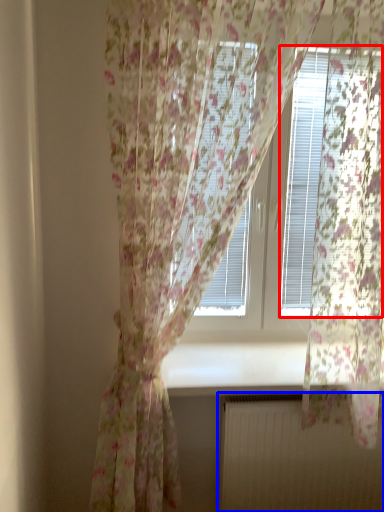
Question: Which of the following is the farthest to the observer, blind (highlighted by a red box) or radiator (highlighted by a blue box)?

Choices:
 (A) blind
 (B) radiator

Answer: (B)